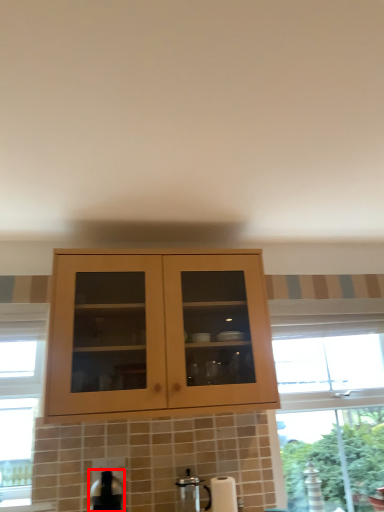
Question: From the image's perspective, where is appliance (annotated by the red box) located in relation to coffee machine in the image?

Choices:
 (A) above
 (B) below

Answer: (A)